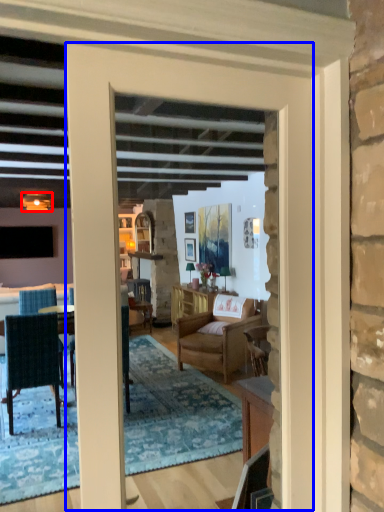
Question: Which of the following is the closest to the observer, lamp (highlighted by a red box) or door (highlighted by a blue box)?

Choices:
 (A) lamp
 (B) door

Answer: (B)